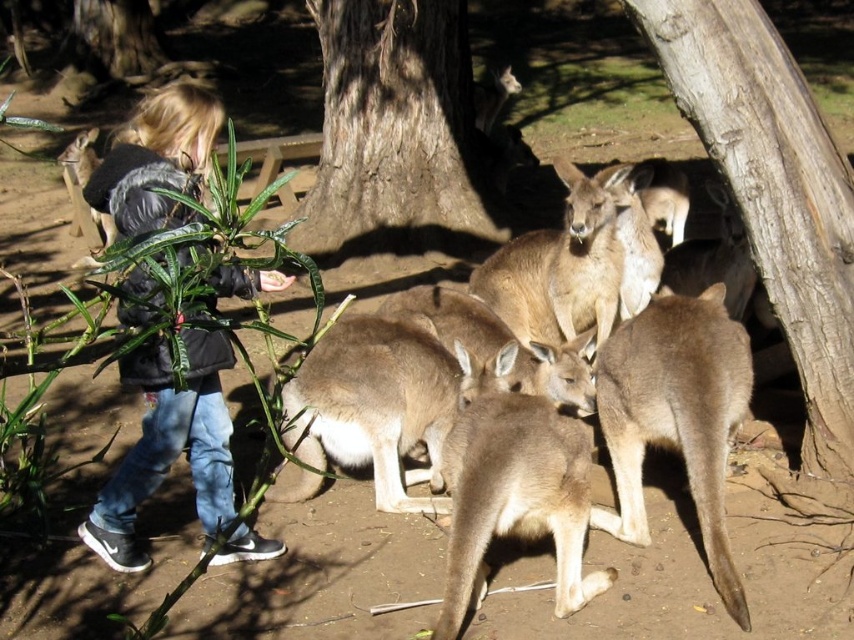
You are a photographer trying to capture the kangaroos in the scene. You notice the light brown fur at center and the brown rough bark tree at center. Which object is wider? Please answer based on their widths.

The light brown fur at center has a lesser width compared to brown rough bark tree at center, so the brown rough bark tree at center is wider.

You are a park ranger who needs to identify trees for a conservation project. You observe the smooth brown bark at upper right and the brown rough bark tree at center. Which tree has a wider trunk?

The brown rough bark tree at center has a wider trunk than the smooth brown bark at upper right.

You are a visitor at the zoo and want to take a photo of the smooth brown bark at upper right without the brown rough bark tree at center blocking it. How should you position yourself to achieve this?

To take a photo of the smooth brown bark at upper right without the brown rough bark tree at center blocking it, position yourself so that the smooth brown bark at upper right is in front of the brown rough bark tree at center. Since the smooth brown bark at upper right is already in front of the brown rough bark tree at center, you can move closer to the smooth brown bark at upper right to ensure it fills the frame while the tree is out of the shot or blurred in the background.